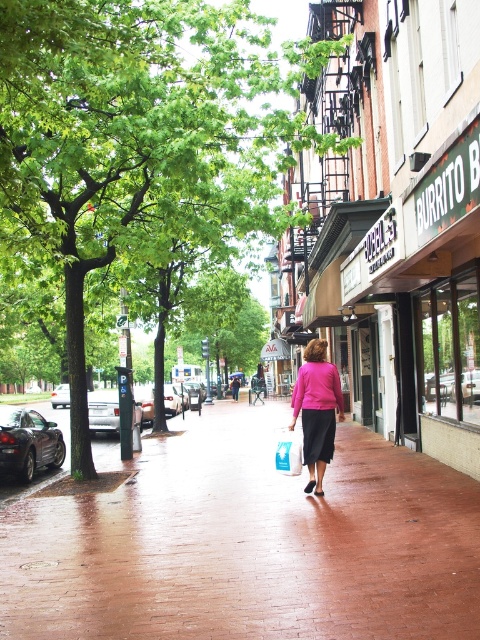
Looking at this image, is red brick sidewalk at center taller than pink matte sweater at center?

Correct, red brick sidewalk at center is much taller as pink matte sweater at center.

The image size is (480, 640). What do you see at coordinates (248, 544) in the screenshot?
I see `red brick sidewalk at center` at bounding box center [248, 544].

Locate an element on the screen. This screenshot has height=640, width=480. red brick sidewalk at center is located at coordinates (248, 544).

Can you confirm if pink matte skirt at center is wider than pink matte sweater at center?

Yes, pink matte skirt at center is wider than pink matte sweater at center.

From the picture: Can you confirm if pink matte skirt at center is thinner than pink matte sweater at center?

No.

Measure the distance between point (342, 420) and camera.

Point (342, 420) is 20.13 meters from camera.

The width and height of the screenshot is (480, 640). I want to click on pink matte skirt at center, so click(316, 410).

Is red brick sidewalk at center smaller than pink matte skirt at center?

Actually, red brick sidewalk at center might be larger than pink matte skirt at center.

Is red brick sidewalk at center wider than pink matte skirt at center?

Yes.

Between point (462, 632) and point (303, 412), which one is positioned behind?

Point (303, 412)

This screenshot has height=640, width=480. I want to click on red brick sidewalk at center, so click(x=248, y=544).